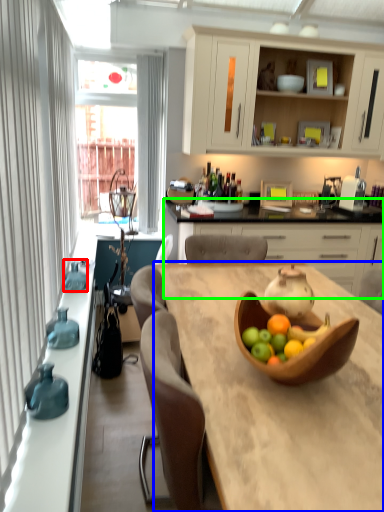
Question: Which is nearer to the vase (highlighted by a red box)? desk (highlighted by a blue box) or cabinetry (highlighted by a green box).

Choices:
 (A) desk
 (B) cabinetry

Answer: (A)